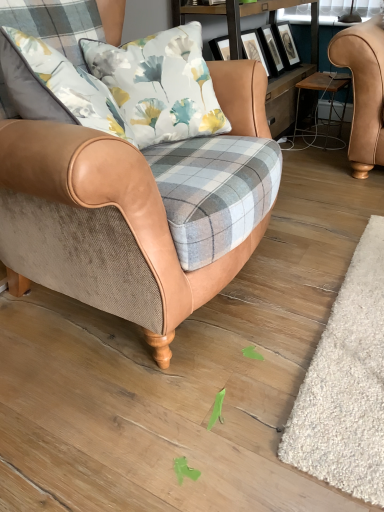
Question: From a real-world perspective, relative to white shaggy rug at lower right, is wooden framed artwork at upper center vertically above or below?

Choices:
 (A) below
 (B) above

Answer: (B)

Question: Based on their sizes in the image, would you say wooden framed artwork at upper center is bigger or smaller than white shaggy rug at lower right?

Choices:
 (A) small
 (B) big

Answer: (B)

Question: Estimate the real-world distances between objects in this image. Which object is closer to the tan leather armchair at center?

Choices:
 (A) wooden framed artwork at upper center
 (B) wooden stool at right
 (C) white shaggy rug at lower right

Answer: (C)

Question: Considering the real-world distances, which object is farthest from the tan leather armchair at center?

Choices:
 (A) white shaggy rug at lower right
 (B) wooden framed artwork at upper center
 (C) wooden stool at right

Answer: (C)